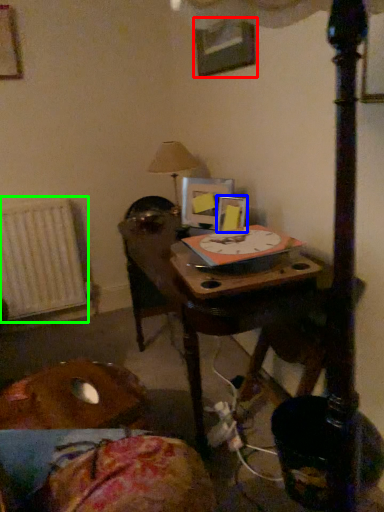
Question: Which is farther away from picture frame (highlighted by a red box)? picture frame (highlighted by a blue box) or radiator (highlighted by a green box)?

Choices:
 (A) picture frame
 (B) radiator

Answer: (B)